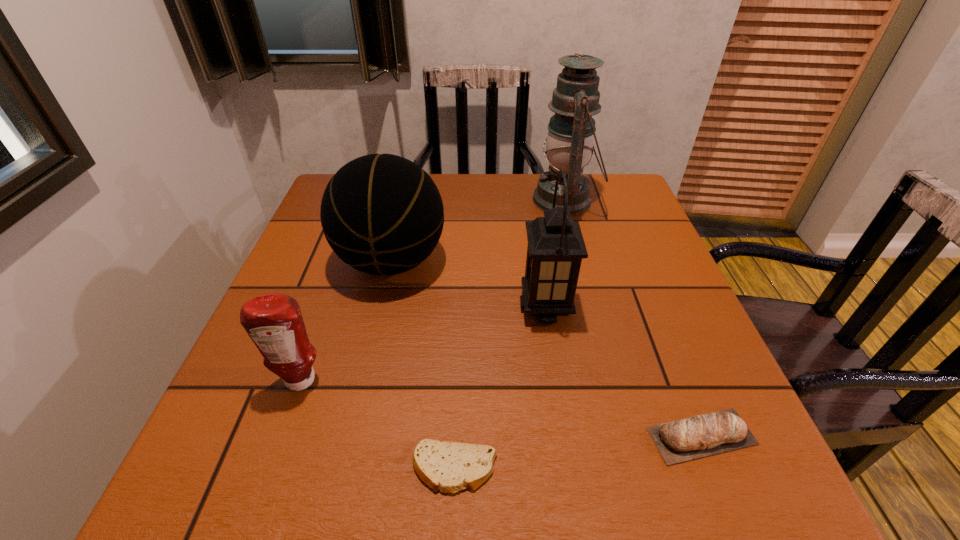
I want to click on free spot that satisfies the following two spatial constraints: 1. on the front side of the fifth shortest object; 2. on the right side of the right pita bread, so click(x=565, y=436).

Identify the location of vacant region that satisfies the following two spatial constraints: 1. on the front side of the fourth shortest object; 2. on the right side of the left pita bread. (344, 468).